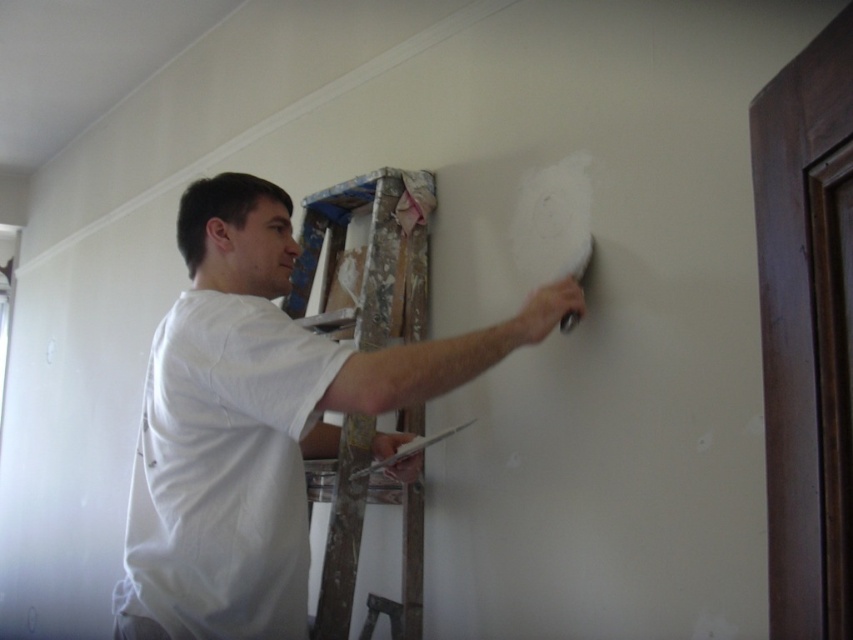
Between white matte t-shirt at center and wooden ladder at center, which one appears on the left side from the viewer's perspective?

From the viewer's perspective, white matte t-shirt at center appears more on the left side.

This screenshot has height=640, width=853. Identify the location of white matte t-shirt at center. (259, 420).

Does white cotton shirt at center appear under wooden ladder at center?

Yes.

Is point (149, 346) less distant than point (419, 257)?

No, (149, 346) is further to viewer.

Does point (241, 355) come closer to viewer compared to point (415, 612)?

That is True.

This screenshot has width=853, height=640. Find the location of `white cotton shirt at center`. white cotton shirt at center is located at coordinates (223, 472).

Which of these two, white matte t-shirt at center or white cotton shirt at center, stands shorter?

With less height is white cotton shirt at center.

The height and width of the screenshot is (640, 853). Find the location of `white matte t-shirt at center`. white matte t-shirt at center is located at coordinates (259, 420).